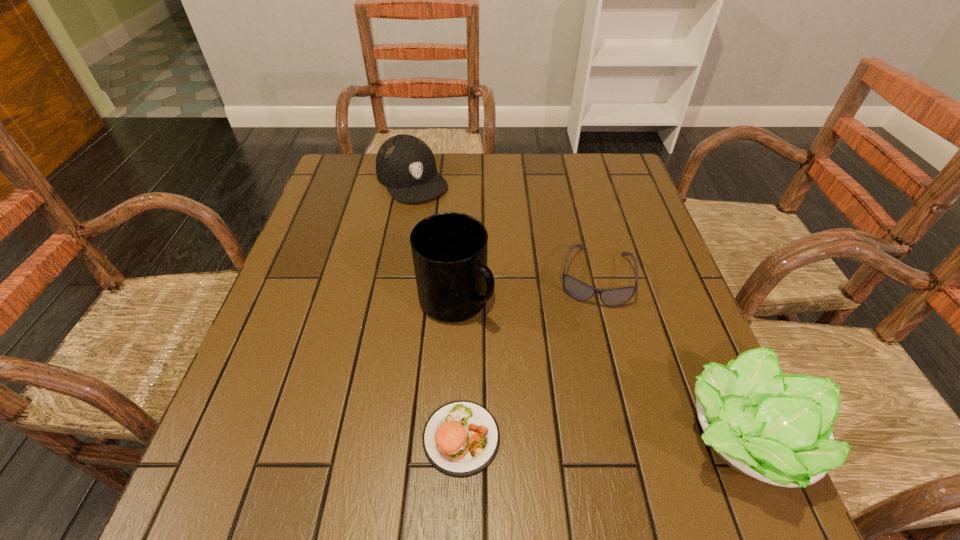
The height and width of the screenshot is (540, 960). I want to click on lettuce situated at the right edge, so click(777, 429).

Find the location of a particular element. sunglasses that is positioned at the right edge is located at coordinates (614, 297).

Find the location of `object that is positioned at the far left corner`. object that is positioned at the far left corner is located at coordinates (406, 165).

Find the location of a particular element. The height and width of the screenshot is (540, 960). object positioned at the near right corner is located at coordinates (777, 429).

In the image, there is a desktop. Where is `free space at the far edge`? The image size is (960, 540). free space at the far edge is located at coordinates (549, 153).

This screenshot has height=540, width=960. I want to click on blank area at the near edge, so tap(504, 414).

This screenshot has width=960, height=540. In the image, there is a desktop. Identify the location of free region at the left edge. coord(300,267).

Locate an element on the screen. blank space at the right edge of the desktop is located at coordinates (602, 242).

The image size is (960, 540). In the image, there is a desktop. In order to click on free space at the far left corner in this screenshot , I will do `click(375, 188)`.

Identify the location of vacant space at the far right corner of the desktop. (595, 166).